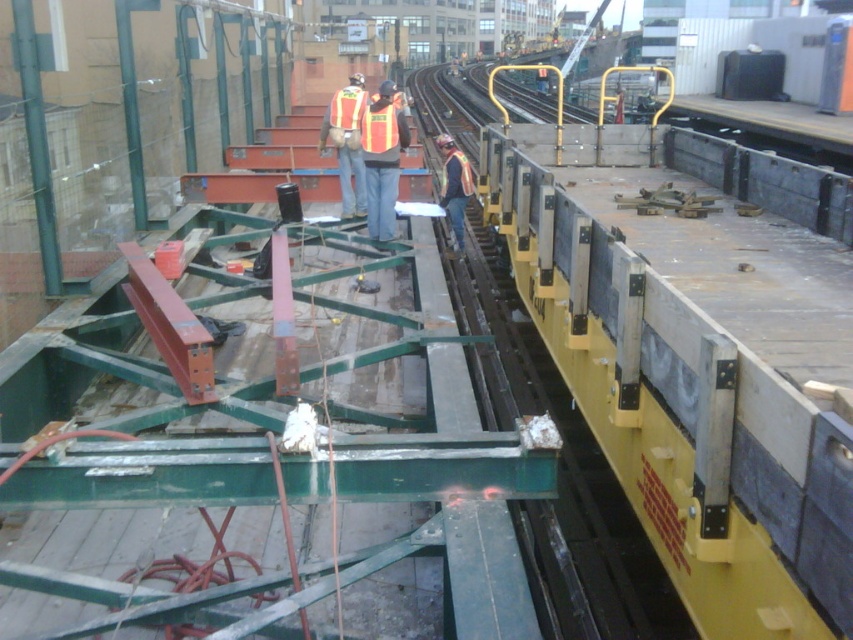
Question: Can you confirm if reflective safety vest at center is positioned to the left of reflective fabric safety vest at center?

Choices:
 (A) no
 (B) yes

Answer: (A)

Question: From the image, what is the correct spatial relationship of yellow painted steel train car at center in relation to reflective fabric safety vest at center?

Choices:
 (A) right
 (B) left

Answer: (A)

Question: Which of the following is the closest to the observer?

Choices:
 (A) (447, 188)
 (B) (381, 138)
 (C) (811, 264)

Answer: (C)

Question: Which point is closer to the camera?

Choices:
 (A) reflective safety vest at center
 (B) yellow painted steel train car at center

Answer: (B)

Question: Which object is farther from the camera taking this photo?

Choices:
 (A) reflective safety vest at center
 (B) yellow painted steel train car at center

Answer: (A)

Question: Is reflective safety vest at center to the left of reflective fabric safety vest at center from the viewer's perspective?

Choices:
 (A) no
 (B) yes

Answer: (A)